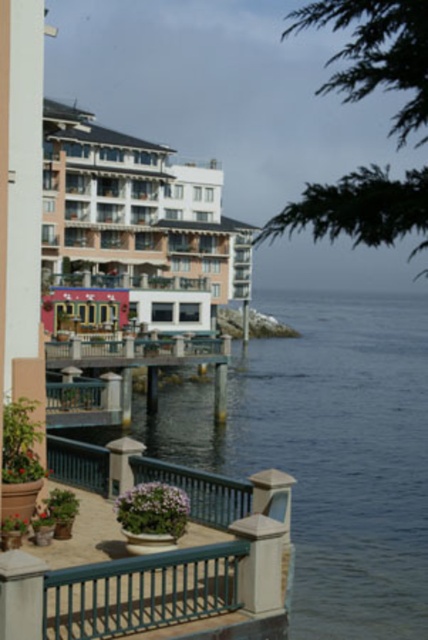
Question: Which object appears farthest from the camera in this image?

Choices:
 (A) beige stucco hotel at center
 (B) wooden dock at lower left
 (C) teal painted wood balcony at lower center

Answer: (A)

Question: Is beige stucco hotel at center above teal painted wood balcony at lower center?

Choices:
 (A) no
 (B) yes

Answer: (B)

Question: Does beige stucco hotel at center have a larger size compared to wooden dock at lower left?

Choices:
 (A) no
 (B) yes

Answer: (B)

Question: Which object appears farthest from the camera in this image?

Choices:
 (A) teal painted wood balcony at lower center
 (B) wooden dock at lower left
 (C) beige stucco hotel at center

Answer: (C)

Question: Which point is farther from the camera taking this photo?

Choices:
 (A) (59, 348)
 (B) (219, 563)
 (C) (97, 148)

Answer: (C)

Question: Does teal painted wood balcony at lower center have a greater width compared to wooden dock at lower left?

Choices:
 (A) no
 (B) yes

Answer: (A)